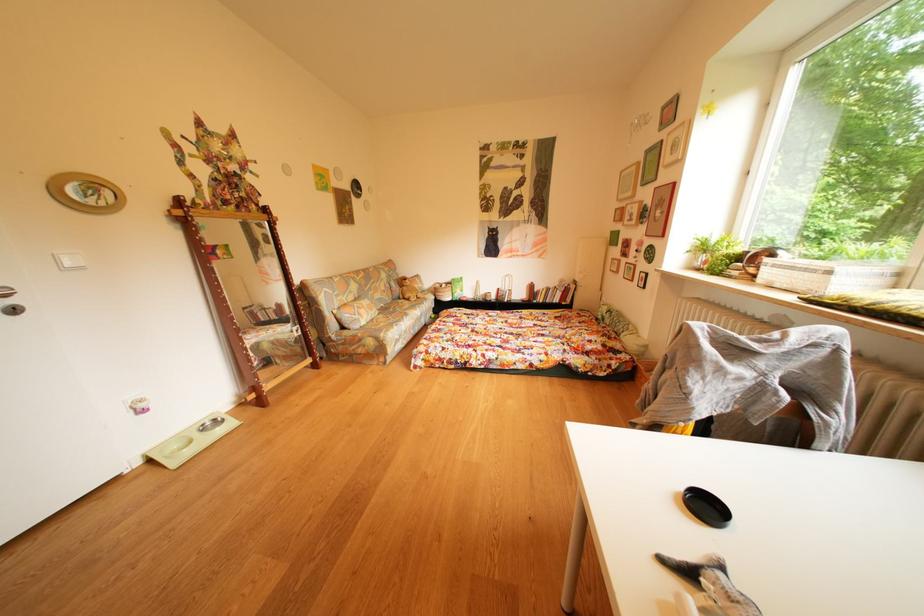
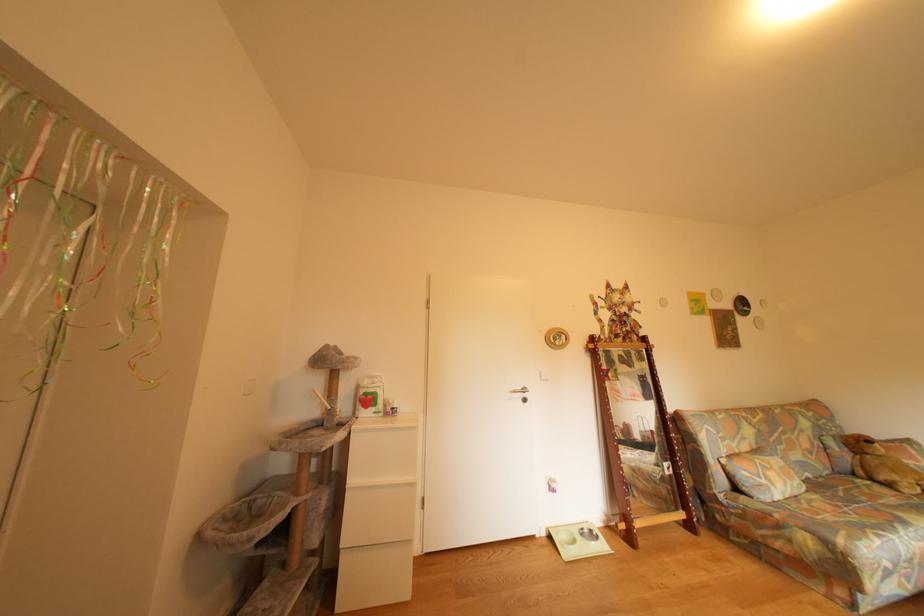
Looking at this image, the images are taken continuously from a first-person perspective. In which direction is your viewpoint rotating?

The camera's rotation is toward left-up.